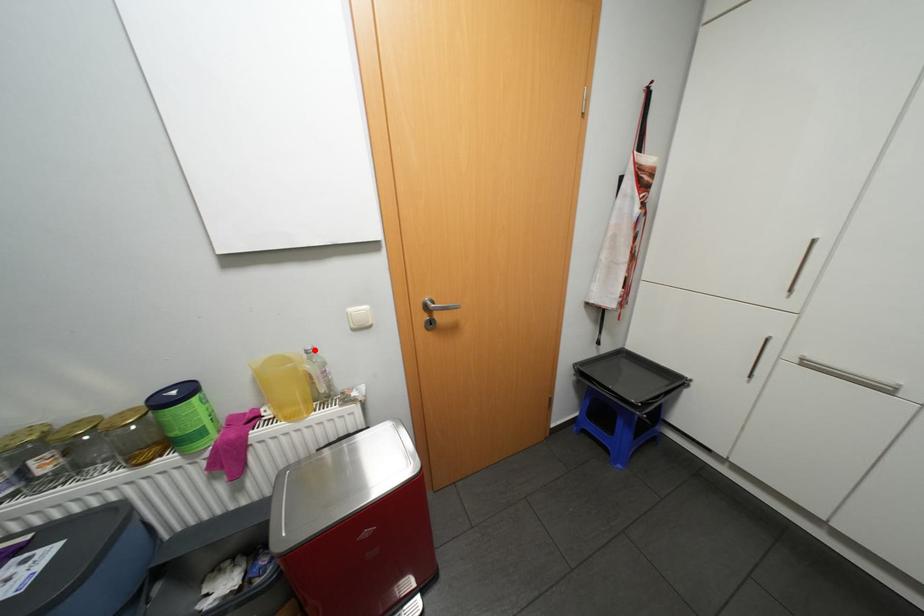
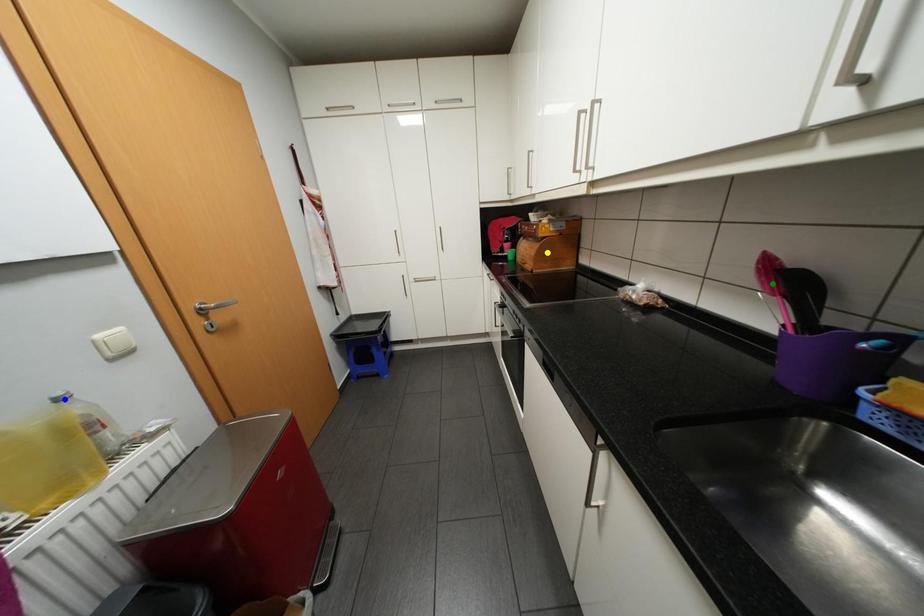
Question: I am providing you with two images of the same scene from different viewpoints. A red point is marked on the first image. You are given multiple points on the second image. Can you choose the point in image 2 that corresponds to the point in image 1?

Choices:
 (A) yellow point
 (B) green point
 (C) blue point

Answer: (C)